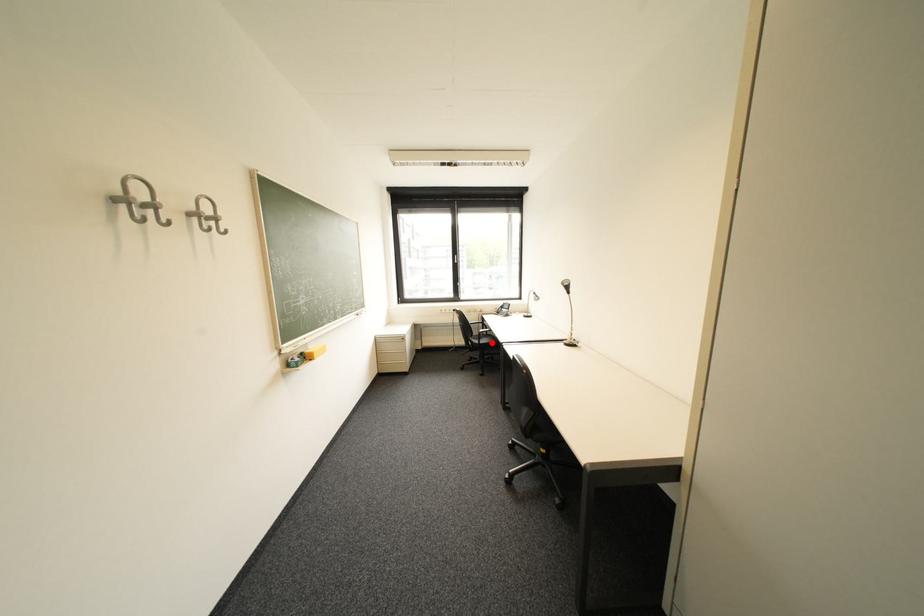
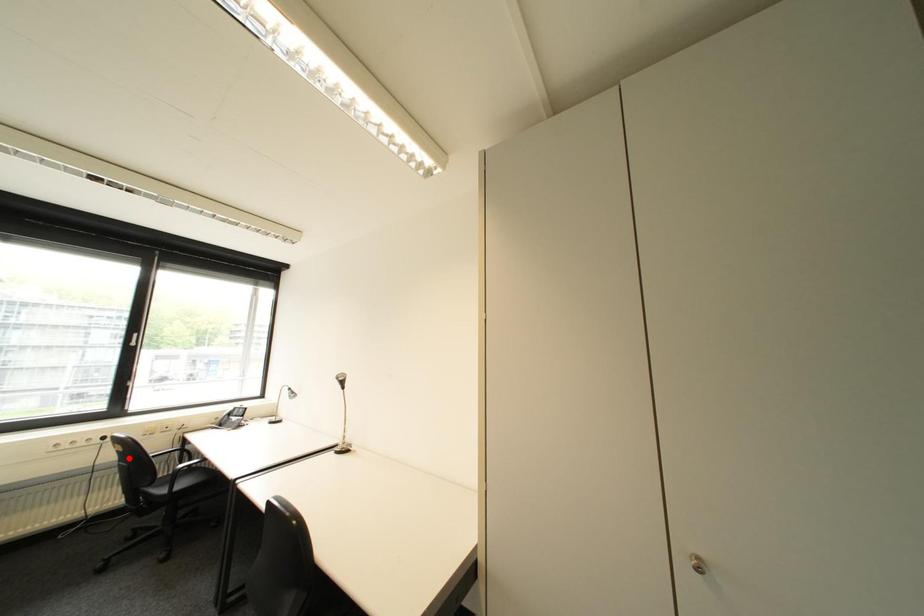
I am providing you with two images of the same scene from different viewpoints. A red point is marked on the first image and another point is marked on the second image. Are the points marked in image1 and image2 representing the same 3D position?

No